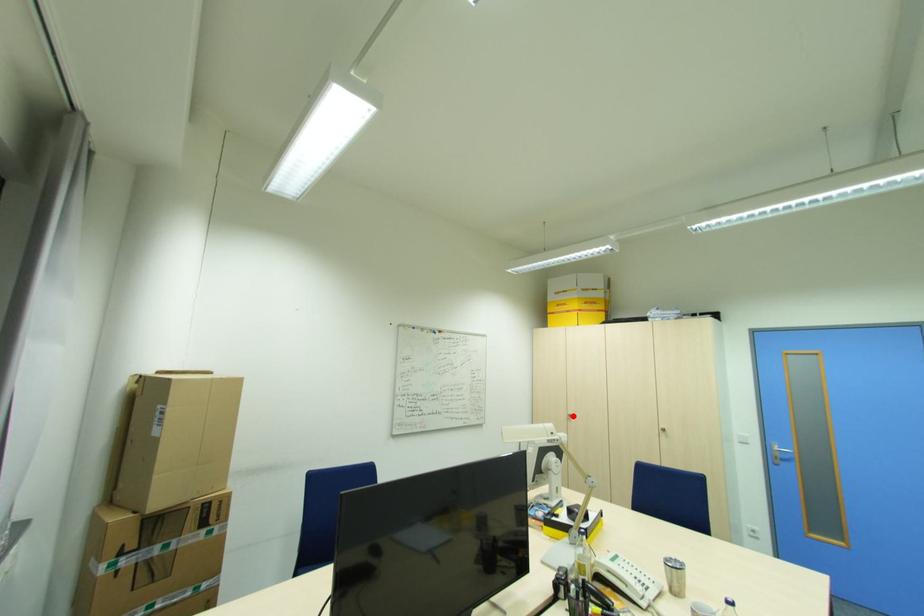
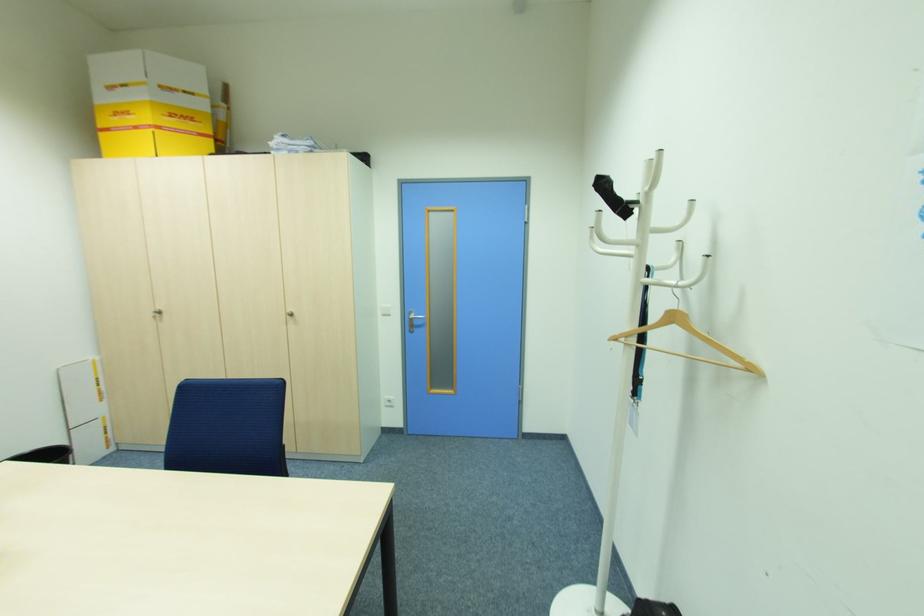
In the second image, find the point that corresponds to the highlighted location in the first image.

(162, 312)